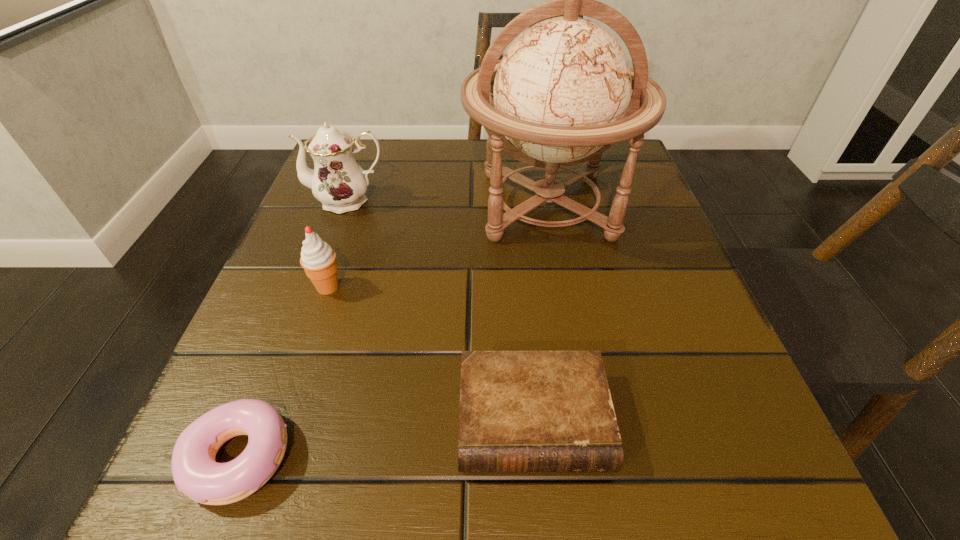
Find the location of a particular element. The image size is (960, 540). free space that satisfies the following two spatial constraints: 1. on the back side of the third shortest object; 2. on the right side of the doughnut is located at coordinates (305, 287).

Identify the location of free spot that satisfies the following two spatial constraints: 1. on the front side of the second tallest object; 2. on the right side of the third tallest object. (316, 287).